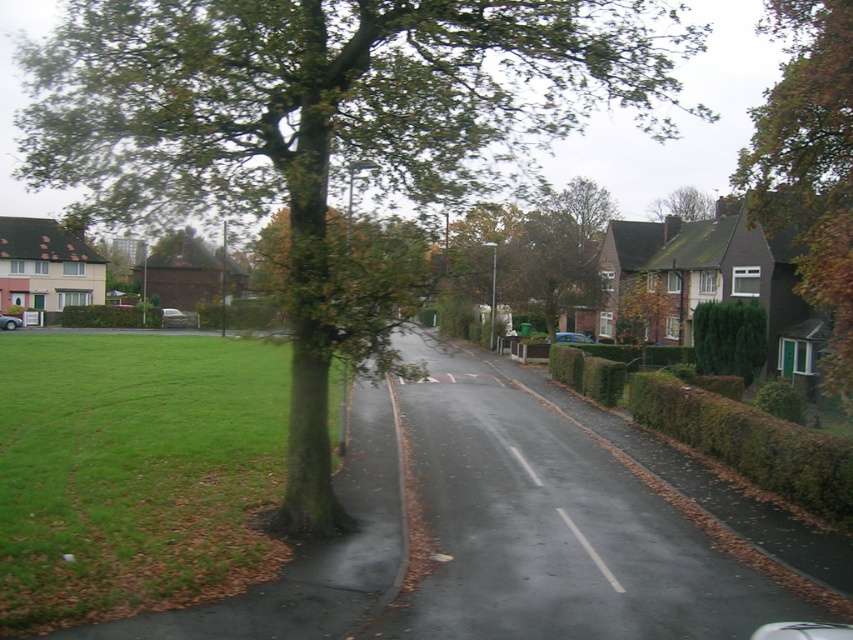
Does brown leafy tree at upper right appear on the right side of blue metallic car at center?

Indeed, brown leafy tree at upper right is positioned on the right side of blue metallic car at center.

Who is more forward, (824, 362) or (572, 340)?

Point (824, 362)

Locate an element on the screen. brown leafy tree at upper right is located at coordinates tap(809, 163).

Between green leafy tree at upper center and silver metallic car at center, which one is positioned lower?

silver metallic car at center

Between green leafy tree at upper center and silver metallic car at center, which one has more height?

green leafy tree at upper center is taller.

Who is more forward, (583,236) or (180,317)?

Point (583,236) is in front.

The height and width of the screenshot is (640, 853). I want to click on green leafy tree at upper center, so click(584, 205).

Can you confirm if brown leafy tree at upper right is thinner than brown textured tree at center?

In fact, brown leafy tree at upper right might be wider than brown textured tree at center.

Is brown leafy tree at upper right smaller than brown textured tree at center?

Actually, brown leafy tree at upper right might be larger than brown textured tree at center.

This screenshot has height=640, width=853. Identify the location of brown leafy tree at upper right. (809, 163).